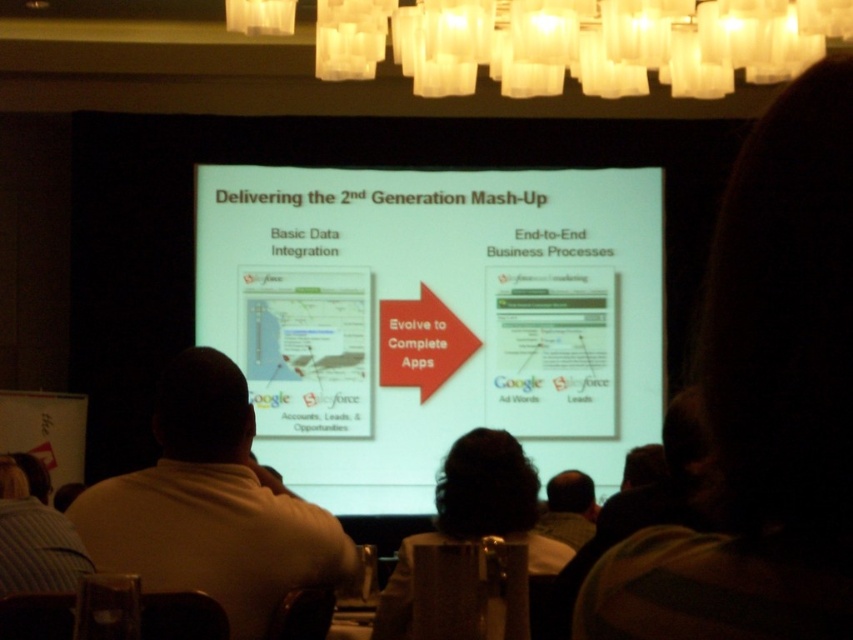
Can you confirm if white matte projector screen at center is shorter than translucent glass chandelier at upper center?

No.

Does white matte projector screen at center come behind translucent glass chandelier at upper center?

Yes.

Which is in front, point (329, 209) or point (467, 1)?

Point (467, 1) is in front.

At what (x,y) coordinates should I click in order to perform the action: click on white matte projector screen at center. Please return your answer as a coordinate pair (x, y). The width and height of the screenshot is (853, 640). Looking at the image, I should click on 433,317.

Who is shorter, white matte projector screen at center or white shirt at center?

Standing shorter between the two is white shirt at center.

Is white matte projector screen at center taller than white shirt at center?

Yes, white matte projector screen at center is taller than white shirt at center.

Describe the element at coordinates (433, 317) in the screenshot. This screenshot has width=853, height=640. I see `white matte projector screen at center` at that location.

Image resolution: width=853 pixels, height=640 pixels. Identify the location of white matte projector screen at center. (433, 317).

Which is in front, point (579, 10) or point (315, 536)?

Point (315, 536) is more forward.

Between translucent glass chandelier at upper center and white shirt at center, which one has less height?

translucent glass chandelier at upper center

Is point (636, 28) behind point (221, 552)?

Yes.

The image size is (853, 640). Identify the location of translucent glass chandelier at upper center. (578, 42).